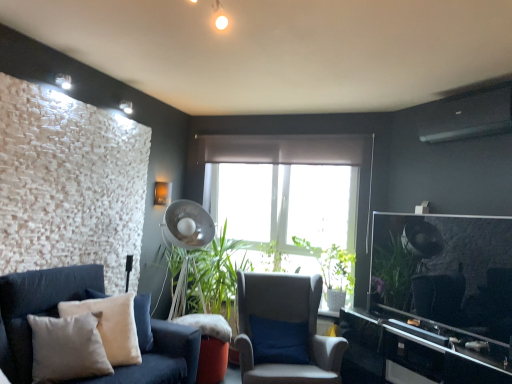
Question: From a real-world perspective, is light gray fabric chair at center physically below black glossy entertainment center at right?

Choices:
 (A) yes
 (B) no

Answer: (B)

Question: Can you confirm if light gray fabric chair at center is positioned to the right of black glossy entertainment center at right?

Choices:
 (A) no
 (B) yes

Answer: (A)

Question: From the image's perspective, is light gray fabric chair at center under black glossy entertainment center at right?

Choices:
 (A) no
 (B) yes

Answer: (A)

Question: Considering the relative positions of light gray fabric chair at center and black glossy entertainment center at right in the image provided, is light gray fabric chair at center in front of black glossy entertainment center at right?

Choices:
 (A) no
 (B) yes

Answer: (A)

Question: Is light gray fabric chair at center facing away from black glossy entertainment center at right?

Choices:
 (A) no
 (B) yes

Answer: (A)

Question: Is black glossy entertainment center at right inside the boundaries of metallic silver mechanical fan at center, or outside?

Choices:
 (A) outside
 (B) inside

Answer: (A)

Question: Is black glossy entertainment center at right in front of or behind metallic silver mechanical fan at center in the image?

Choices:
 (A) front
 (B) behind

Answer: (A)

Question: From the image's perspective, is black glossy entertainment center at right located above or below metallic silver mechanical fan at center?

Choices:
 (A) below
 (B) above

Answer: (A)

Question: Based on their positions, is black glossy entertainment center at right located to the left or right of metallic silver mechanical fan at center?

Choices:
 (A) right
 (B) left

Answer: (A)

Question: From their relative heights in the image, would you say soft cotton couch at lower left is taller or shorter than light gray fabric chair at center?

Choices:
 (A) short
 (B) tall

Answer: (A)

Question: From the image's perspective, relative to light gray fabric chair at center, is soft cotton couch at lower left above or below?

Choices:
 (A) below
 (B) above

Answer: (B)

Question: Is point (159, 337) closer or farther from the camera than point (316, 370)?

Choices:
 (A) closer
 (B) farther

Answer: (B)

Question: Choose the correct answer: Is soft cotton couch at lower left inside light gray fabric chair at center or outside it?

Choices:
 (A) outside
 (B) inside

Answer: (A)

Question: Considering the positions of green matte plant at center and beige velvet pillow at lower left in the image, is green matte plant at center taller or shorter than beige velvet pillow at lower left?

Choices:
 (A) tall
 (B) short

Answer: (A)

Question: Is green matte plant at center inside the boundaries of beige velvet pillow at lower left, or outside?

Choices:
 (A) inside
 (B) outside

Answer: (B)